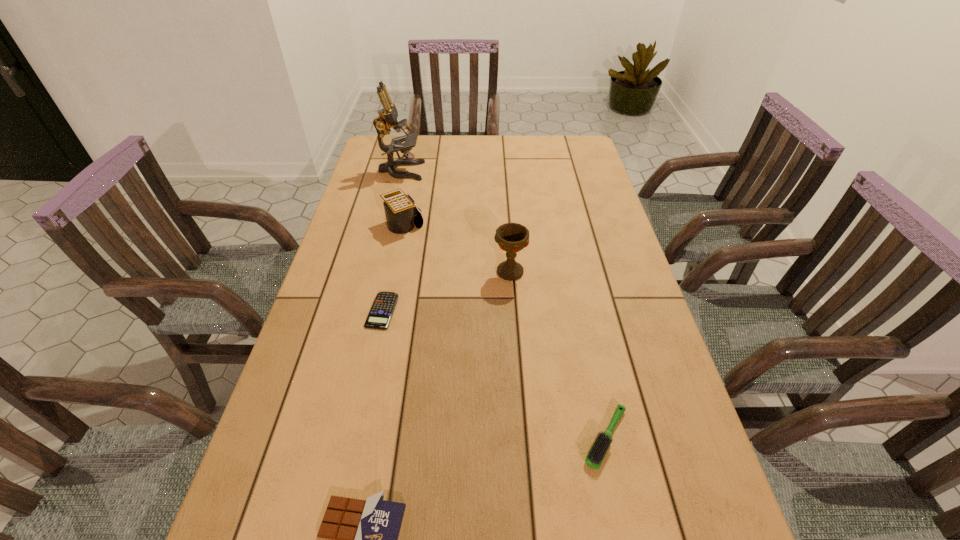
The image size is (960, 540). I want to click on free spot located 0.080m at the eyepieces of the tallest object, so click(445, 171).

This screenshot has height=540, width=960. Find the location of `blank space located 0.280m on the right of the third farthest object`. blank space located 0.280m on the right of the third farthest object is located at coordinates (628, 272).

This screenshot has height=540, width=960. I want to click on free space located 0.380m on the front of the third tallest object, so click(380, 338).

Locate an element on the screen. The height and width of the screenshot is (540, 960). vacant space located 0.080m on the back of the hairbrush is located at coordinates (592, 375).

Where is `free space located 0.070m on the right of the shorter calculator`? free space located 0.070m on the right of the shorter calculator is located at coordinates (424, 310).

This screenshot has height=540, width=960. Find the location of `object that is positioned at the far edge`. object that is positioned at the far edge is located at coordinates (387, 118).

Where is `microscope that is at the left edge`? Image resolution: width=960 pixels, height=540 pixels. microscope that is at the left edge is located at coordinates (387, 118).

Locate an element on the screen. The width and height of the screenshot is (960, 540). object that is at the right edge is located at coordinates (597, 451).

Find the location of `object located in the far left corner section of the desktop`. object located in the far left corner section of the desktop is located at coordinates (387, 118).

At what (x,y) coordinates should I click in order to perform the action: click on free space at the far edge of the desktop. Please return your answer as a coordinate pair (x, y). The width and height of the screenshot is (960, 540). Looking at the image, I should click on (522, 137).